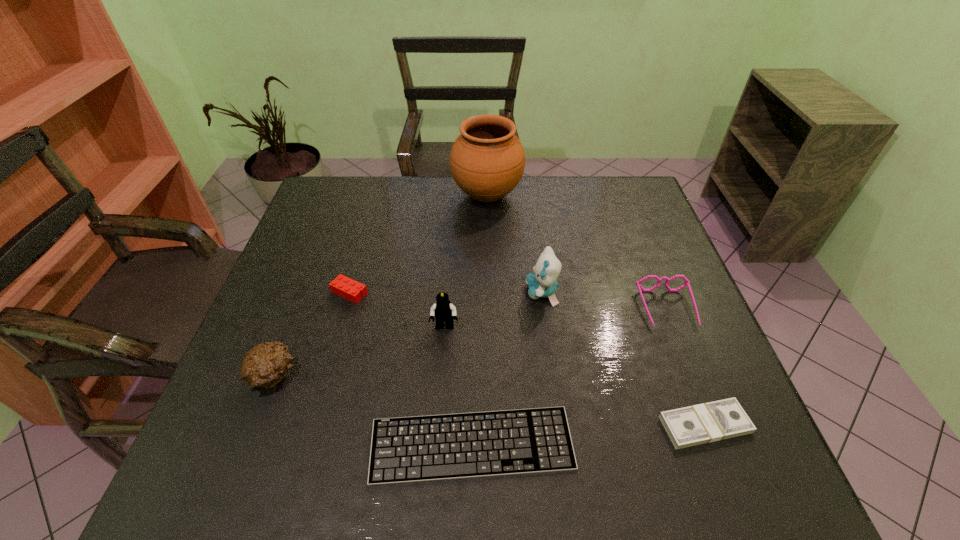
You are a GUI agent. You are given a task and a screenshot of the screen. Output one action in this format:
    pyautogui.click(x=<x>, y=<y>)
    Task: Click on the seventh tallest object
    
    Given the screenshot: What is the action you would take?
    pyautogui.click(x=718, y=420)

Locate an element on the screen. This screenshot has height=540, width=960. the shortest object is located at coordinates (495, 443).

This screenshot has width=960, height=540. Find the location of `free space located 0.130m on the right of the pottery`. free space located 0.130m on the right of the pottery is located at coordinates (563, 195).

This screenshot has height=540, width=960. What are the coordinates of `vacant space located 0.340m on the face of the kitten` in the screenshot? It's located at (393, 292).

At what (x,y) coordinates should I click in order to perform the action: click on free space located 0.070m on the face of the kitten. Please return your answer as a coordinate pair (x, y). The height and width of the screenshot is (540, 960). Looking at the image, I should click on (498, 292).

Locate an element on the screen. Image resolution: width=960 pixels, height=540 pixels. vacant space positioned on the face of the kitten is located at coordinates (420, 292).

This screenshot has height=540, width=960. In order to click on free space located 0.100m on the front-facing side of the third tallest object in this screenshot , I will do `click(442, 370)`.

In order to click on vacant point located 0.170m on the back of the sixth farthest object in this screenshot , I will do `click(303, 298)`.

This screenshot has width=960, height=540. I want to click on free location located on the arms of the spectacles, so click(709, 417).

Locate an element on the screen. vacant space situated 0.070m on the right of the third shortest object is located at coordinates (396, 292).